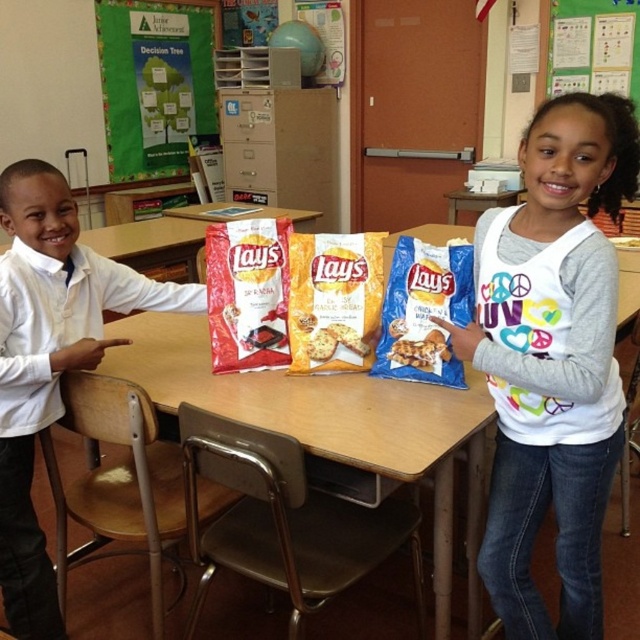
Does white soft shirt at upper right have a larger size compared to green paper at upper center?

Correct, white soft shirt at upper right is larger in size than green paper at upper center.

Does white soft shirt at upper right have a smaller size compared to green paper at upper center?

No, white soft shirt at upper right is not smaller than green paper at upper center.

This screenshot has width=640, height=640. What do you see at coordinates (552, 358) in the screenshot? I see `white soft shirt at upper right` at bounding box center [552, 358].

Where is `white soft shirt at upper right`? The height and width of the screenshot is (640, 640). white soft shirt at upper right is located at coordinates (552, 358).

Who is more distant from viewer, (435, 538) or (52, 372)?

Point (52, 372)

Which is below, wooden table at center or white matte shirt at left?

white matte shirt at left is lower down.

What do you see at coordinates (328, 422) in the screenshot? This screenshot has height=640, width=640. I see `wooden table at center` at bounding box center [328, 422].

The width and height of the screenshot is (640, 640). Identify the location of wooden table at center. (328, 422).

Does white soft shirt at upper right have a larger size compared to green fabric poster at upper left?

Actually, white soft shirt at upper right might be smaller than green fabric poster at upper left.

Is white soft shirt at upper right below green fabric poster at upper left?

Correct, white soft shirt at upper right is located below green fabric poster at upper left.

Where is `white soft shirt at upper right`? The width and height of the screenshot is (640, 640). white soft shirt at upper right is located at coordinates (552, 358).